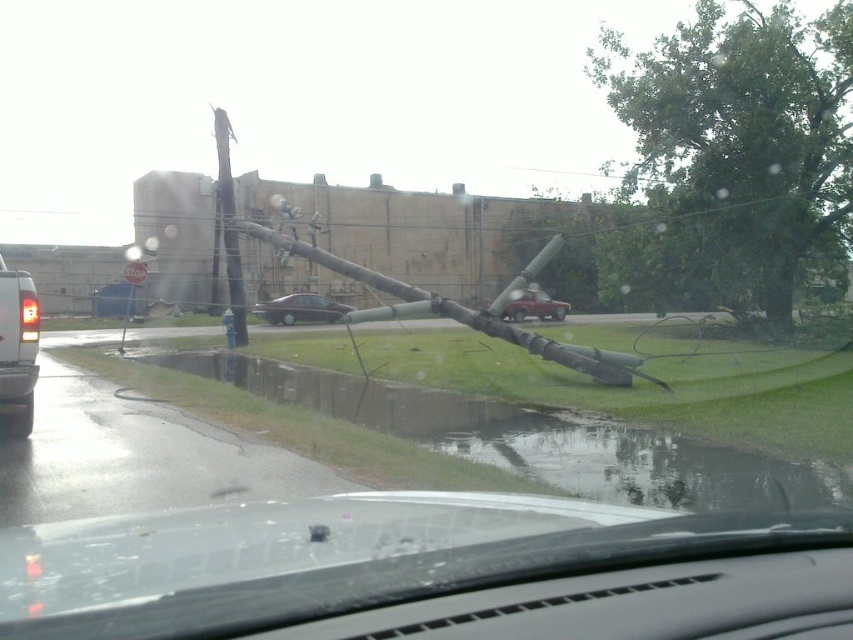
Question: Among these points, which one is nearest to the camera?

Choices:
 (A) (352, 307)
 (B) (24, 397)

Answer: (B)

Question: Observing the image, what is the correct spatial positioning of dark gray matte sedan at center in reference to matte red truck at center?

Choices:
 (A) below
 (B) above

Answer: (B)

Question: Which point is closer to the camera?

Choices:
 (A) (281, 304)
 (B) (550, 314)

Answer: (A)

Question: Can you confirm if matte silver van at left is wider than dark gray matte sedan at center?

Choices:
 (A) yes
 (B) no

Answer: (B)

Question: Does matte silver van at left have a lesser width compared to matte red truck at center?

Choices:
 (A) yes
 (B) no

Answer: (A)

Question: Which object is farther from the camera taking this photo?

Choices:
 (A) dark gray matte sedan at center
 (B) matte silver van at left
 (C) matte red truck at center

Answer: (A)